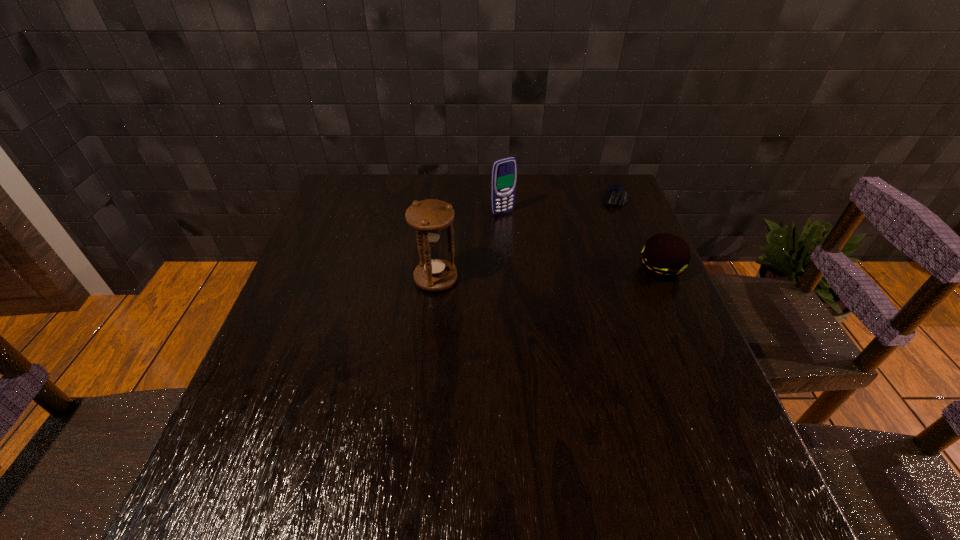
The height and width of the screenshot is (540, 960). Identify the location of vacant area located on the front-facing side of the third nearest object. (x=517, y=226).

The width and height of the screenshot is (960, 540). What are the coordinates of `vacant region located 0.210m on the front-facing side of the third nearest object` in the screenshot? It's located at (547, 259).

Locate an element on the screen. The height and width of the screenshot is (540, 960). vacant space situated on the button side of the shortest object is located at coordinates (599, 234).

Locate an element on the screen. The image size is (960, 540). vacant space located on the button side of the shortest object is located at coordinates (574, 286).

At what (x,y) coordinates should I click in order to perform the action: click on vacant space located on the button side of the shortest object. Please return your answer as a coordinate pair (x, y). The image size is (960, 540). Looking at the image, I should click on (601, 231).

The width and height of the screenshot is (960, 540). I want to click on cellular telephone present at the far edge, so click(x=504, y=171).

Locate an element on the screen. computer mouse that is at the far edge is located at coordinates (615, 196).

The height and width of the screenshot is (540, 960). In order to click on patty at the right edge in this screenshot , I will do `click(664, 257)`.

What are the coordinates of `computer mouse present at the right edge` in the screenshot? It's located at (615, 196).

Where is `object at the far right corner`? This screenshot has width=960, height=540. object at the far right corner is located at coordinates (615, 196).